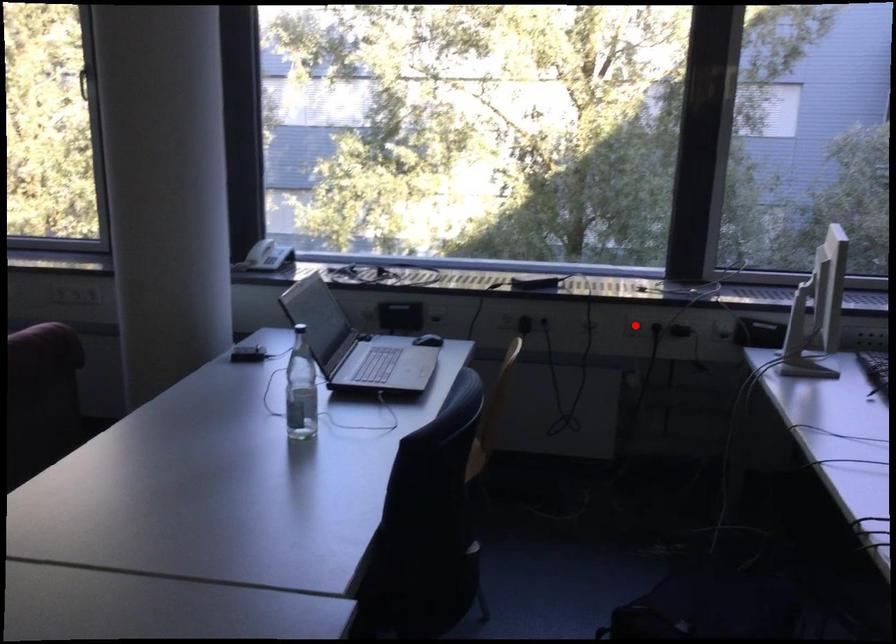
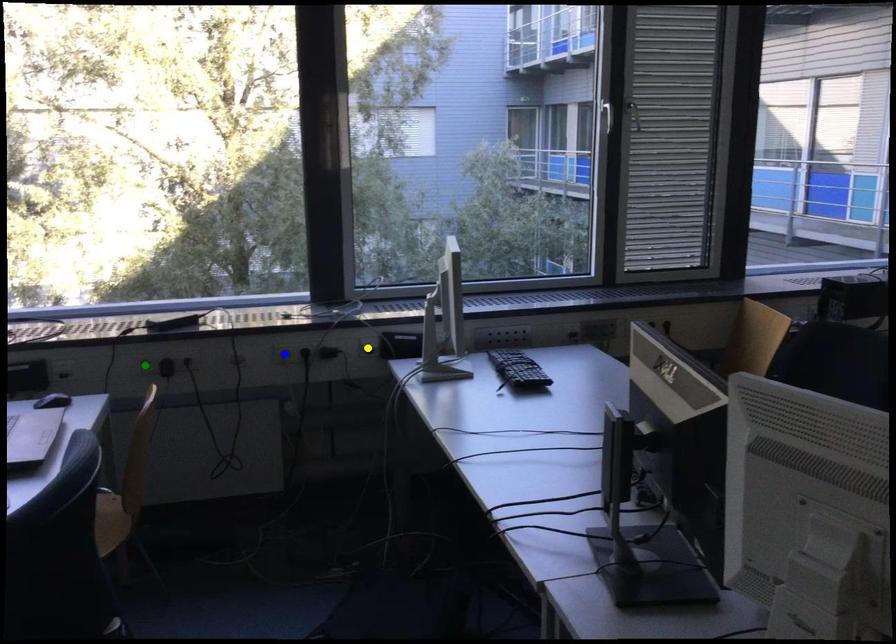
Question: I am providing you with two images of the same scene from different viewpoints. A red point is marked on the first image. You are given multiple points on the second image. Which mark in image 2 goes with the point in image 1?

Choices:
 (A) yellow point
 (B) blue point
 (C) green point

Answer: (B)